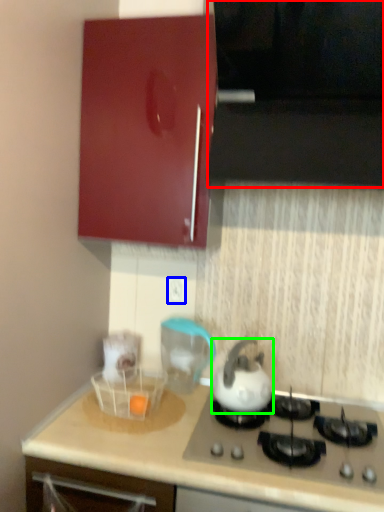
Question: Based on their relative distances, which object is farther from vent (highlighted by a red box)? Choose from electric outlet (highlighted by a blue box) and kettle (highlighted by a green box).

Choices:
 (A) electric outlet
 (B) kettle

Answer: (A)